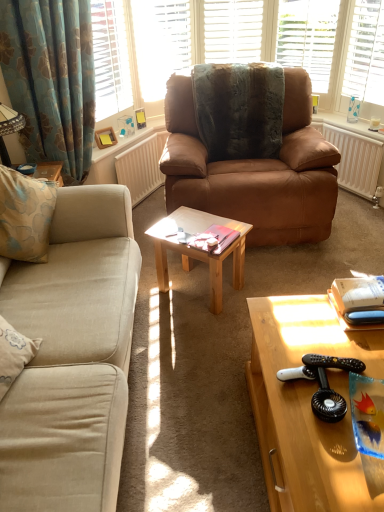
Question: Is matte wooden picture frame at upper left oriented away from brown leather armchair at center, which is the second studio couch in left-to-right order?

Choices:
 (A) yes
 (B) no

Answer: (B)

Question: From the image's perspective, is matte wooden picture frame at upper left on top of brown leather armchair at center, positioned as the first studio couch in back-to-front order?

Choices:
 (A) yes
 (B) no

Answer: (A)

Question: Is matte wooden picture frame at upper left oriented towards brown leather armchair at center, positioned as the first studio couch in back-to-front order?

Choices:
 (A) yes
 (B) no

Answer: (A)

Question: Does matte wooden picture frame at upper left have a lesser height compared to brown leather armchair at center, which is the second studio couch in left-to-right order?

Choices:
 (A) yes
 (B) no

Answer: (A)

Question: Is matte wooden picture frame at upper left taller than brown leather armchair at center, the 1th studio couch viewed from the right?

Choices:
 (A) no
 (B) yes

Answer: (A)

Question: Considering the relative sizes of matte wooden picture frame at upper left and brown leather armchair at center, the 1th studio couch viewed from the right, in the image provided, is matte wooden picture frame at upper left wider than brown leather armchair at center, the 1th studio couch viewed from the right,?

Choices:
 (A) no
 (B) yes

Answer: (A)

Question: From a real-world perspective, is white wood blinds at upper center, the second window when ordered from left to right, over blue floral fabric curtain at left?

Choices:
 (A) no
 (B) yes

Answer: (B)

Question: Is white wood blinds at upper center, marked as the second window in a right-to-left arrangement, taller than blue floral fabric curtain at left?

Choices:
 (A) yes
 (B) no

Answer: (B)

Question: Is white wood blinds at upper center, marked as the second window in a right-to-left arrangement, located outside blue floral fabric curtain at left?

Choices:
 (A) no
 (B) yes

Answer: (B)

Question: Is white wood blinds at upper center, the second window when ordered from left to right, beside blue floral fabric curtain at left?

Choices:
 (A) yes
 (B) no

Answer: (B)

Question: Is white wood blinds at upper center, marked as the second window in a right-to-left arrangement, aimed at blue floral fabric curtain at left?

Choices:
 (A) no
 (B) yes

Answer: (A)

Question: Is white wood blinds at upper center, marked as the second window in a right-to-left arrangement, oriented away from blue floral fabric curtain at left?

Choices:
 (A) no
 (B) yes

Answer: (A)

Question: Does matte wooden picture frame at upper left have a lesser width compared to white textured radiator at right, marked as the 2th radiator in a left-to-right arrangement?

Choices:
 (A) yes
 (B) no

Answer: (A)